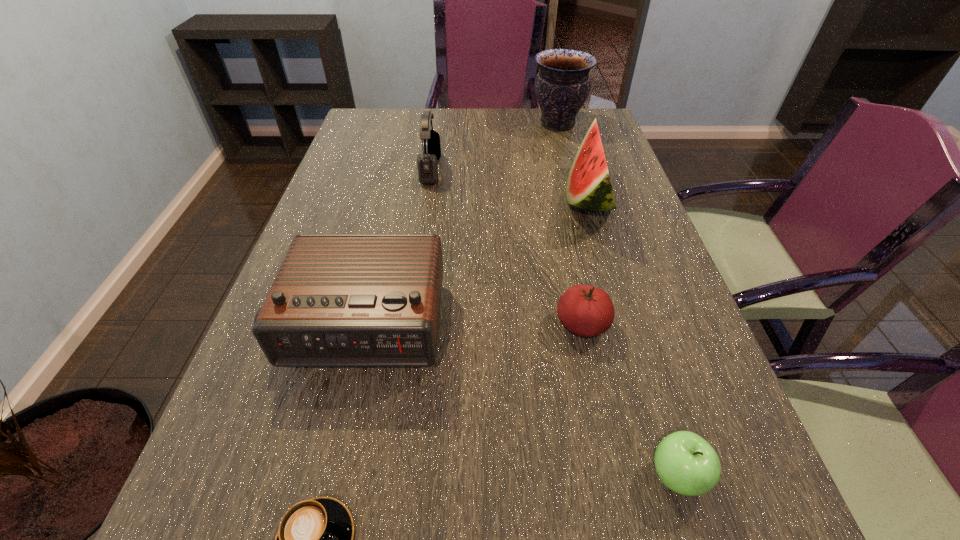
You are a GUI agent. You are given a task and a screenshot of the screen. Output one action in this format:
    pyautogui.click(x=<x>, y=<y>)
    Task: Click on the vacant space located 0.300m on the outer rind of the watermelon
    
    Given the screenshot: What is the action you would take?
    pyautogui.click(x=455, y=199)

Image resolution: width=960 pixels, height=540 pixels. What are the coordinates of `free space located 0.140m on the outer rind of the watermelon` in the screenshot? It's located at (513, 199).

The height and width of the screenshot is (540, 960). In order to click on free spot located 0.210m on the headband of the headset in this screenshot , I will do `click(510, 170)`.

Locate an element on the screen. The height and width of the screenshot is (540, 960). free space located 0.240m on the front panel of the radio receiver is located at coordinates (317, 518).

Image resolution: width=960 pixels, height=540 pixels. Find the location of `free space located on the left of the tomato`. free space located on the left of the tomato is located at coordinates (516, 325).

Find the location of a particular element. Image resolution: width=960 pixels, height=540 pixels. vacant space located on the right of the apple is located at coordinates (751, 476).

Find the location of a particular element. object that is at the far edge is located at coordinates (562, 85).

Find the location of a particular element. The width and height of the screenshot is (960, 540). object situated at the left edge is located at coordinates (339, 300).

The image size is (960, 540). In order to click on pottery located in the right edge section of the desktop in this screenshot , I will do `click(562, 85)`.

In order to click on watermelon at the right edge in this screenshot , I will do `click(588, 186)`.